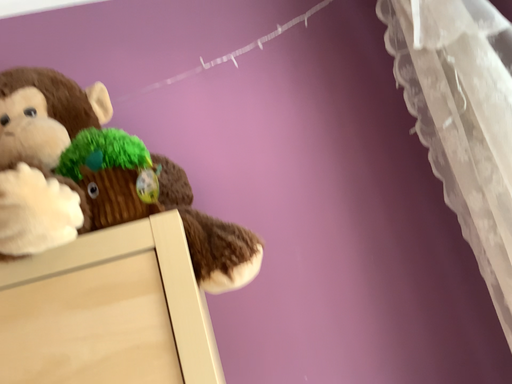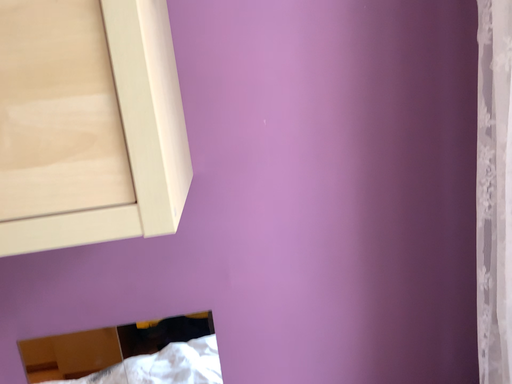
Question: How did the camera likely rotate when shooting the video?

Choices:
 (A) rotated upward
 (B) rotated downward

Answer: (B)